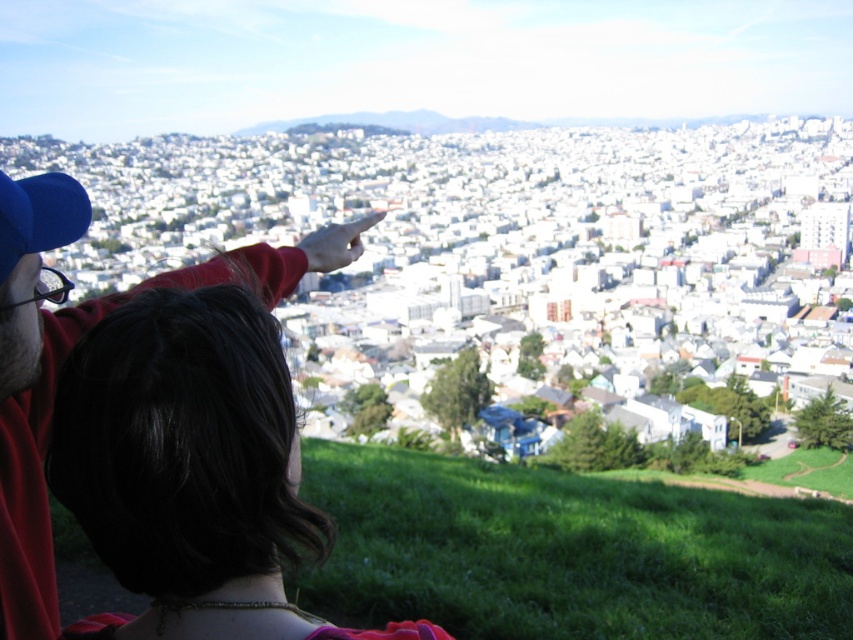
You are observing the scene from the top of the hill. There are two blue caps visible at the upper left corner of your view. Which one is closer to you, the blue fabric cap at upper left or the blue fabric baseball cap at upper left?

The blue fabric cap at upper left is closer to you because it is in front of the blue fabric baseball cap at upper left in the scene.

You are observing the scene from the vantage point. There are two blue caps visible at the upper left corner of the image. One is labeled as the blue fabric cap at upper left and the other as the blue fabric baseball cap at upper left. From your perspective, which one is positioned more to the left?

The blue fabric baseball cap at upper left is positioned more to the left because the blue fabric cap at upper left is to the right of it.